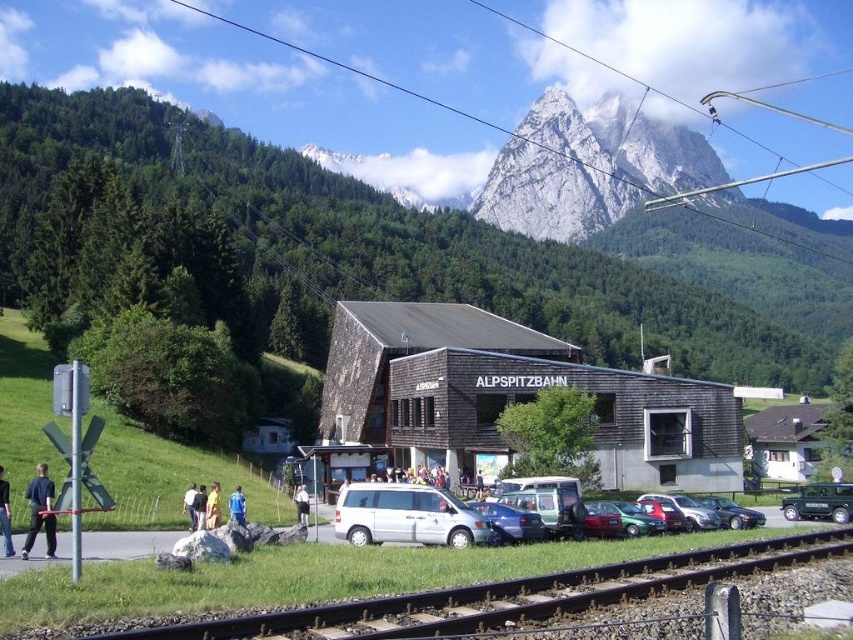
You are standing at the ALPSPITZBAHN building and want to walk to the black asphalt train track at lower center. According to the coordinates provided, in which direction should you walk relative to the building?

The black asphalt train track at lower center is located at coordinates point (514, 595). Since the building is at the lower part of the image, moving towards higher coordinates would mean walking towards the upper direction. Therefore, you should walk upwards from the ALPSPITZBAHN building to reach the black asphalt train track at lower center.

You are a photographer trying to capture a photo of the yellow fabric at lower center and the blue fabric shirt at lower center in the scene. Which object will appear smaller in your photo?

The yellow fabric at lower center will appear smaller in the photo because it occupies less space than the blue fabric shirt at lower center.

You are a hiker planning to take a photo of the white rocky mountain at upper center from the ALPSPITZBAHN building. Based on its coordinates, would you position yourself to the left or right side of the building for the best view?

The white rocky mountain at upper center is located at point coordinates, so positioning yourself on the right side of the ALPSPITZBAHN building would provide a clearer view as the mountain is positioned to the upper center relative to the scene.